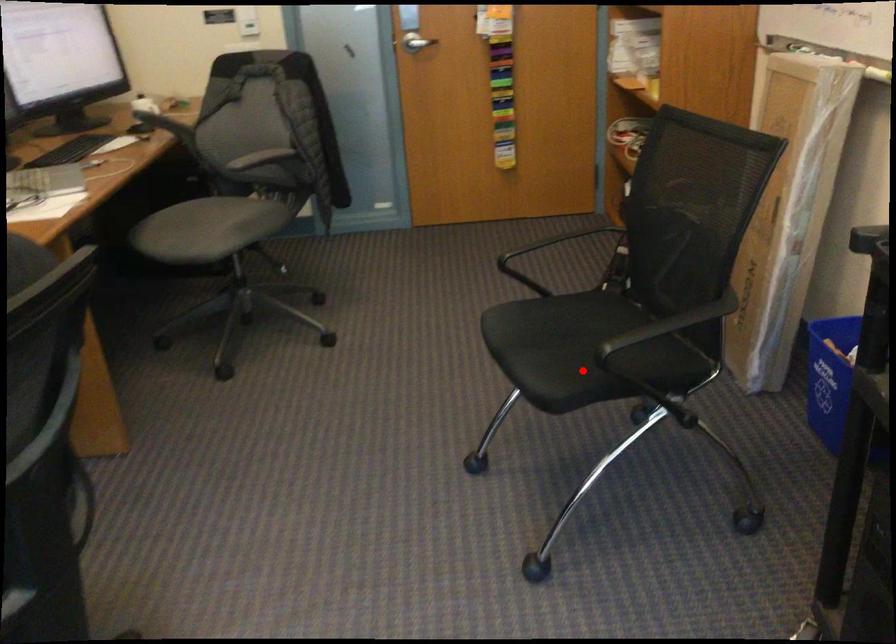
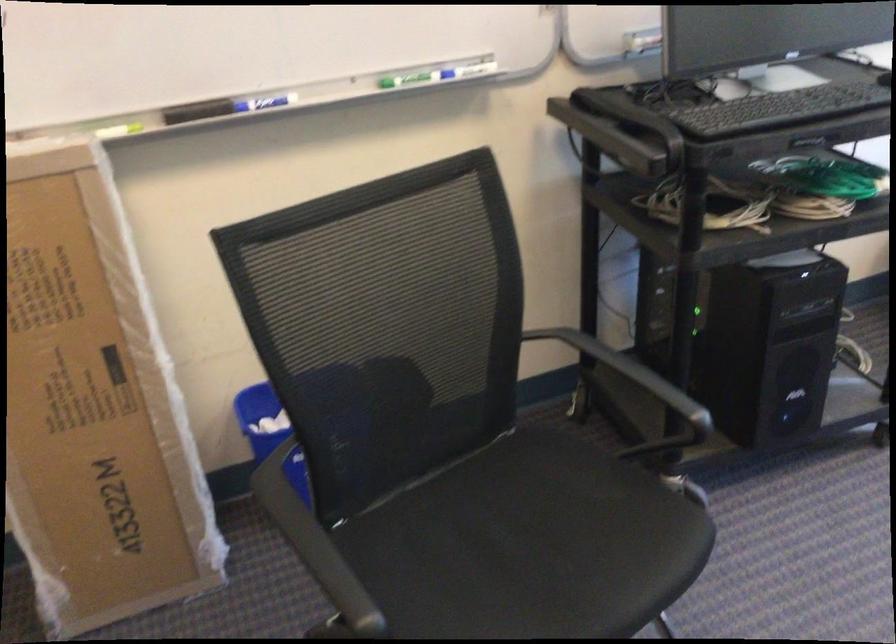
Find the pixel in the second image that matches the highlighted location in the first image.

(530, 545)